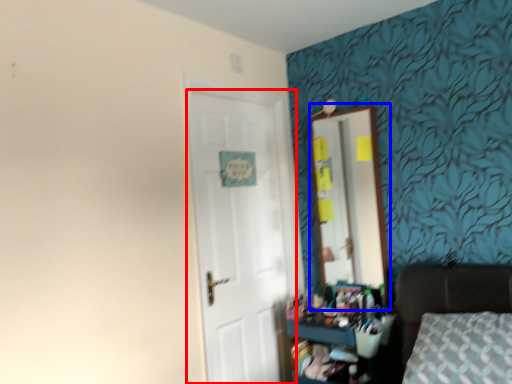
Question: Among these objects, which one is farthest to the camera, door (highlighted by a red box) or mirror (highlighted by a blue box)?

Choices:
 (A) door
 (B) mirror

Answer: (B)